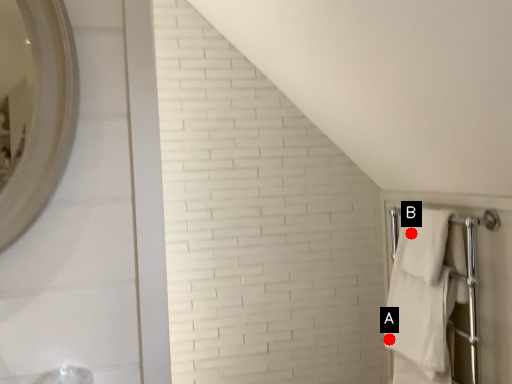
Question: Two points are circled on the image, labeled by A and B beside each circle. Which point is closer to the camera?

Choices:
 (A) A is closer
 (B) B is closer

Answer: (B)